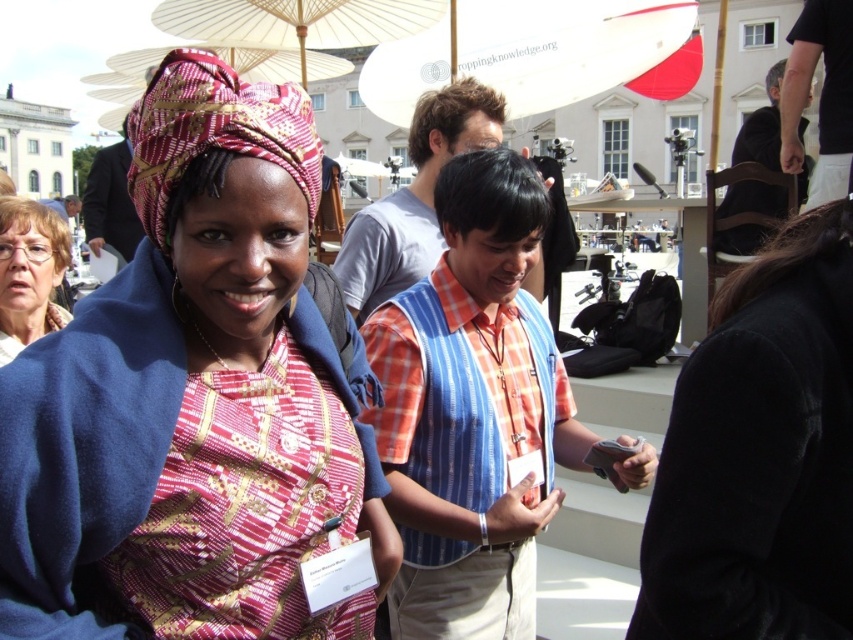
Question: Which object is the farthest from the matte black glasses at upper left?

Choices:
 (A) matte fabric headscarf at upper left
 (B) white matte umbrella at upper center

Answer: (B)

Question: Which point is farther to the camera?

Choices:
 (A) (497, 6)
 (B) (44, 221)
 (C) (186, 52)

Answer: (A)

Question: Is printed fabric headscarf at center smaller than white paper umbrella at upper center?

Choices:
 (A) yes
 (B) no

Answer: (A)

Question: Which point is closer to the camera?

Choices:
 (A) (305, 170)
 (B) (279, 20)
 (C) (171, 557)
 (D) (19, 346)

Answer: (C)

Question: Does printed fabric headscarf at center appear under white paper umbrella at upper center?

Choices:
 (A) yes
 (B) no

Answer: (A)

Question: Is white matte umbrella at upper center positioned at the back of white paper umbrella at upper center?

Choices:
 (A) no
 (B) yes

Answer: (B)